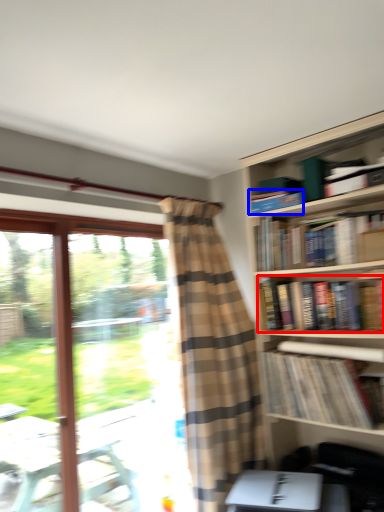
Question: Which object is further to the camera taking this photo, book (highlighted by a red box) or book (highlighted by a blue box)?

Choices:
 (A) book
 (B) book

Answer: (B)